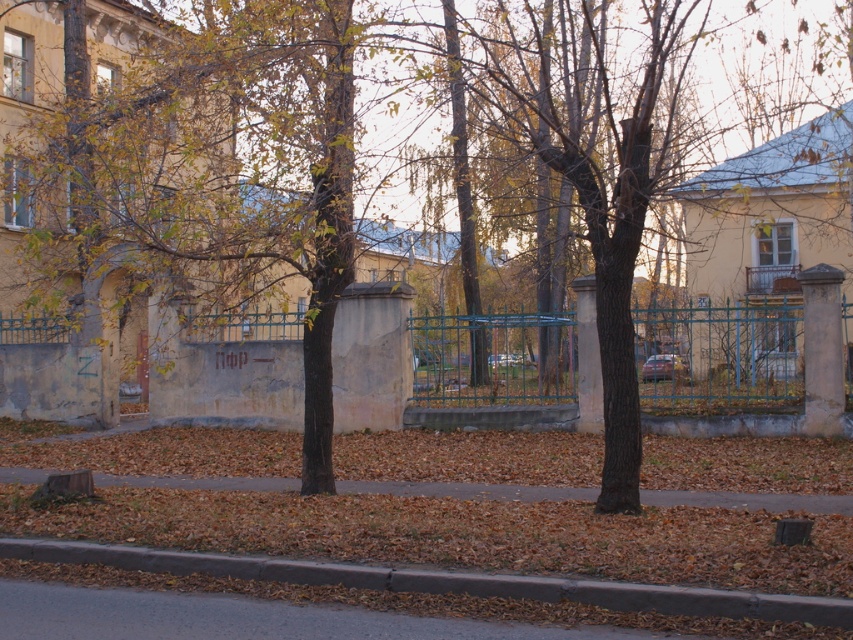
You are a pedestrian standing on the paved road looking towards the grassy area. Which object, the brown bark tree at center or the green metal fence at center, is positioned to the right of the other?

The brown bark tree at center is to the right of the green metal fence at center.

You are a delivery robot that is 3 feet wide. You need to move from the gray concrete curb at lower center to the green metal fence at center. Can you pass through the space between them without any obstacles?

The green metal fence at center is 36.09 feet from the gray concrete curb at lower center. Since the robot is only 3 feet wide, there is sufficient space for it to pass through the 36.09 feet gap between them without any issues.